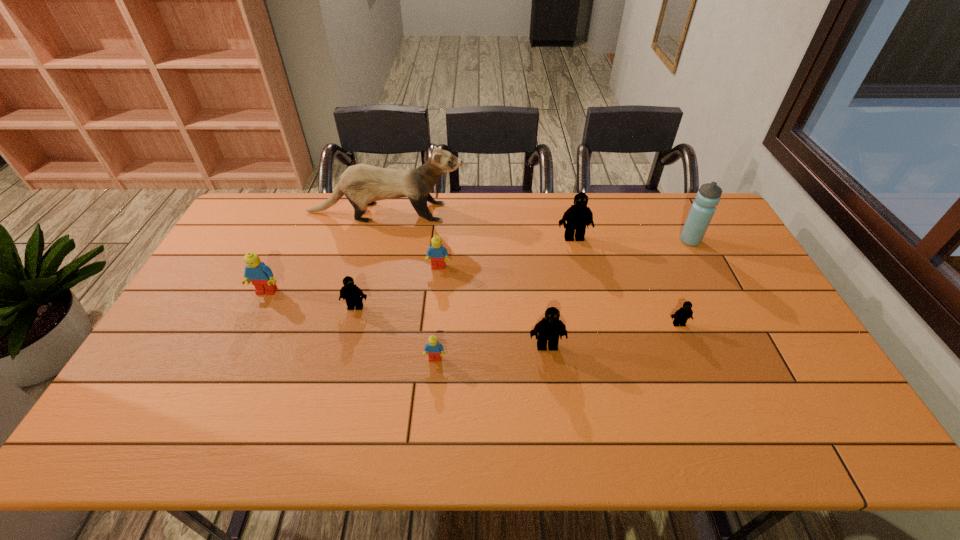
The height and width of the screenshot is (540, 960). Find the location of `the second Lego from left to right`. the second Lego from left to right is located at coordinates pyautogui.click(x=350, y=292).

At what (x,y) coordinates should I click in order to perform the action: click on the second farthest Lego. Please return your answer as a coordinate pair (x, y). Looking at the image, I should click on [437, 252].

Where is `the farthest blue Lego`? The image size is (960, 540). the farthest blue Lego is located at coordinates (437, 252).

This screenshot has width=960, height=540. I want to click on the second nearest black Lego, so click(681, 316).

Locate an element on the screen. Image resolution: width=960 pixels, height=540 pixels. the rightmost black Lego is located at coordinates (681, 316).

Find the location of a particular element. The image size is (960, 540). the nearest blue Lego is located at coordinates [434, 349].

Locate an element on the screen. The width and height of the screenshot is (960, 540). the nearest object is located at coordinates (434, 349).

Where is `blank space located on the face of the farthest object`? This screenshot has height=540, width=960. blank space located on the face of the farthest object is located at coordinates (499, 212).

Identify the location of vacant space located on the back of the water bottle. The image size is (960, 540). (665, 194).

In order to click on blank space located 0.350m on the face of the biggest black Lego in this screenshot , I will do `click(593, 322)`.